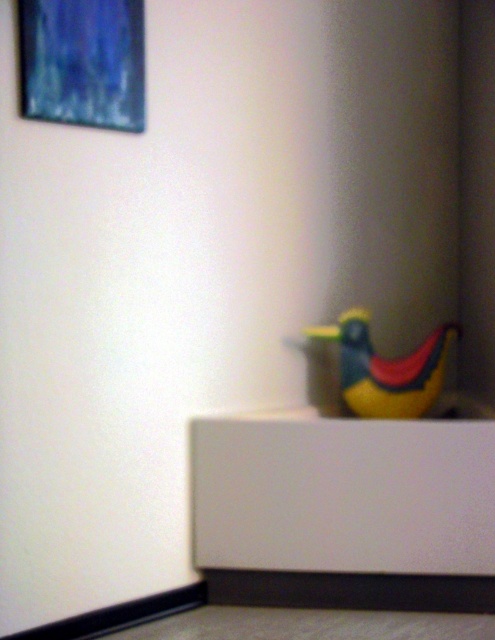
You are an interior designer planning to hang a new picture frame between the blue textured canvas at upper left and the yellow rubber duck at lower right. Considering their sizes, which object should the new frame be placed closer to for balance?

The blue textured canvas at upper left is much taller than the yellow rubber duck at lower right, so the new frame should be placed closer to the yellow rubber duck at lower right to balance the visual weight.

You are an interior designer arranging a room. You have a blue textured canvas at upper left and a yellow rubber duck at lower right. Which object is closer to you when standing in the room?

The blue textured canvas at upper left is closer to you because it is in front of the yellow rubber duck at lower right.